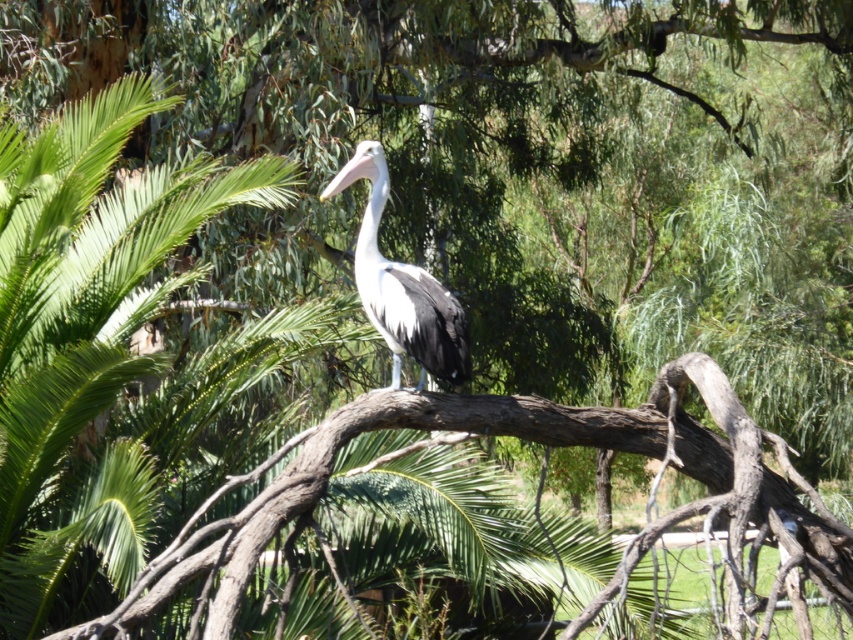
Question: Does green leafy palm tree at upper left appear on the right side of brown rough tree branch at center?

Choices:
 (A) yes
 (B) no

Answer: (B)

Question: Is brown rough tree branch at center above white glossy pelican at center?

Choices:
 (A) no
 (B) yes

Answer: (A)

Question: Estimate the real-world distances between objects in this image. Which object is closer to the white glossy pelican at center?

Choices:
 (A) green leafy palm tree at upper left
 (B) brown rough tree branch at center

Answer: (B)

Question: Which of the following is the farthest from the observer?

Choices:
 (A) brown rough tree branch at center
 (B) white glossy pelican at center
 (C) green leafy palm tree at upper left

Answer: (C)

Question: Which object is positioned closest to the green leafy palm tree at upper left?

Choices:
 (A) brown rough tree branch at center
 (B) white glossy pelican at center

Answer: (A)

Question: Where is green leafy palm tree at upper left located in relation to white glossy pelican at center in the image?

Choices:
 (A) below
 (B) above

Answer: (B)